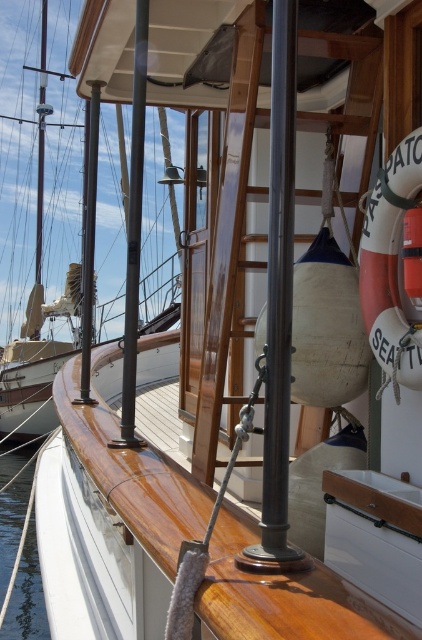
Question: Can you confirm if polished dark wood pole at center is smaller than transparent water at lower left?

Choices:
 (A) yes
 (B) no

Answer: (B)

Question: Is polished dark wood pole at center wider than transparent water at lower left?

Choices:
 (A) no
 (B) yes

Answer: (A)

Question: Is polished dark wood pole at center above transparent water at lower left?

Choices:
 (A) no
 (B) yes

Answer: (B)

Question: Which point is closer to the camera?

Choices:
 (A) (134, 244)
 (B) (16, 460)

Answer: (A)

Question: Among these objects, which one is farthest from the camera?

Choices:
 (A) transparent water at lower left
 (B) polished dark wood pole at center

Answer: (A)